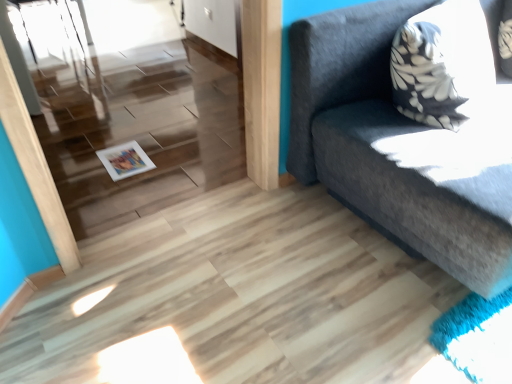
Question: Which is correct: dark gray fabric couch at upper right is inside white glossy door at upper center, or outside of it?

Choices:
 (A) inside
 (B) outside

Answer: (B)

Question: Considering the positions of point (463, 173) and point (204, 6), is point (463, 173) closer or farther from the camera than point (204, 6)?

Choices:
 (A) farther
 (B) closer

Answer: (B)

Question: Estimate the real-world distances between objects in this image. Which object is farther from the white glossy door at upper center?

Choices:
 (A) white glossy magazine at lower left
 (B) dark gray fabric couch at upper right

Answer: (B)

Question: Based on their relative distances, which object is nearer to the white glossy door at upper center?

Choices:
 (A) white glossy magazine at lower left
 (B) dark gray fabric couch at upper right

Answer: (A)